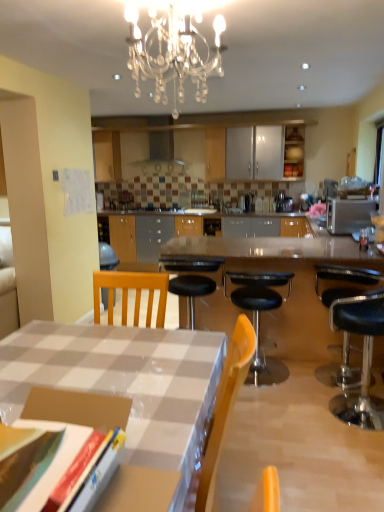
Question: Does silver metallic microwave at right have a greater width compared to polished granite table at center?

Choices:
 (A) yes
 (B) no

Answer: (B)

Question: Would you say silver metallic microwave at right is a long distance from polished granite table at center?

Choices:
 (A) yes
 (B) no

Answer: (B)

Question: Does silver metallic microwave at right turn towards polished granite table at center?

Choices:
 (A) yes
 (B) no

Answer: (B)

Question: Is silver metallic microwave at right facing away from polished granite table at center?

Choices:
 (A) no
 (B) yes

Answer: (A)

Question: Considering the relative positions of silver metallic microwave at right and polished granite table at center in the image provided, is silver metallic microwave at right in front of polished granite table at center?

Choices:
 (A) no
 (B) yes

Answer: (A)

Question: Can you confirm if silver metallic microwave at right is thinner than polished granite table at center?

Choices:
 (A) yes
 (B) no

Answer: (A)

Question: Does polished granite table at center lie behind white glossy desk at lower left?

Choices:
 (A) no
 (B) yes

Answer: (B)

Question: Is polished granite table at center not within white glossy desk at lower left?

Choices:
 (A) no
 (B) yes

Answer: (B)

Question: Does polished granite table at center have a smaller size compared to white glossy desk at lower left?

Choices:
 (A) no
 (B) yes

Answer: (A)

Question: From a real-world perspective, is polished granite table at center under white glossy desk at lower left?

Choices:
 (A) yes
 (B) no

Answer: (B)

Question: Is polished granite table at center facing away from white glossy desk at lower left?

Choices:
 (A) no
 (B) yes

Answer: (B)

Question: Can you confirm if polished granite table at center is positioned to the left of white glossy desk at lower left?

Choices:
 (A) yes
 (B) no

Answer: (B)

Question: Is black leather stool at right, the 2th chair in the left-to-right sequence, positioned behind silver metallic microwave at right?

Choices:
 (A) no
 (B) yes

Answer: (A)